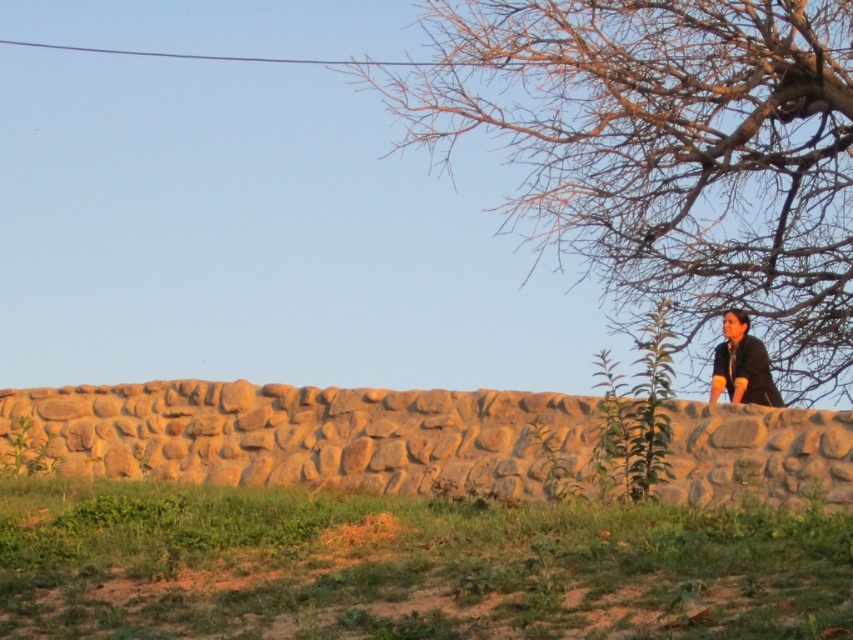
Question: Is brown textured tree at upper right thinner than black matte shirt at upper right?

Choices:
 (A) yes
 (B) no

Answer: (B)

Question: Which object is positioned farthest from the brown textured tree at upper right?

Choices:
 (A) black matte shirt at upper right
 (B) rustic stone wall at center

Answer: (B)

Question: Can you confirm if brown textured tree at upper right is positioned to the right of black matte shirt at upper right?

Choices:
 (A) yes
 (B) no

Answer: (A)

Question: Which of the following is the farthest from the observer?

Choices:
 (A) rustic stone wall at center
 (B) black matte shirt at upper right

Answer: (B)

Question: Does brown textured tree at upper right appear on the right side of black matte shirt at upper right?

Choices:
 (A) no
 (B) yes

Answer: (B)

Question: Based on their relative distances, which object is nearer to the black matte shirt at upper right?

Choices:
 (A) brown textured tree at upper right
 (B) rustic stone wall at center

Answer: (B)